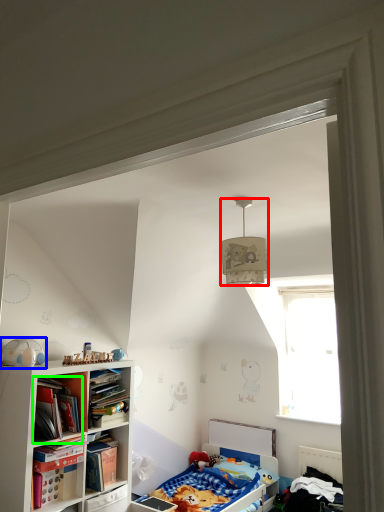
Question: Which object is positioned closest to lamp (highlighted by a red box)? Select from toy (highlighted by a blue box) and book (highlighted by a green box).

Choices:
 (A) toy
 (B) book

Answer: (B)